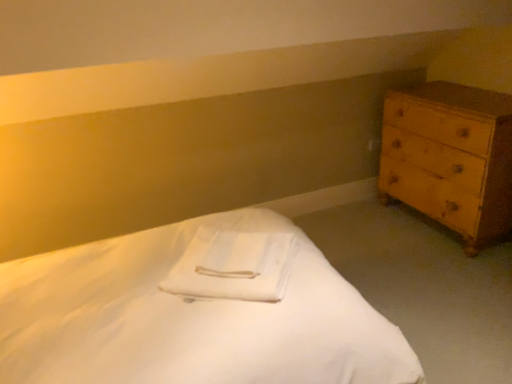
Locate an element on the screen. The height and width of the screenshot is (384, 512). free space in front of light brown wooden chest of drawers at right is located at coordinates (442, 282).